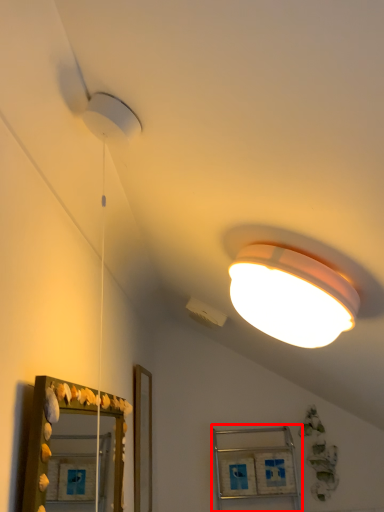
Question: From the image's perspective, what is the correct spatial relationship of cabinet (annotated by the red box) in relation to mirror?

Choices:
 (A) above
 (B) below

Answer: (B)